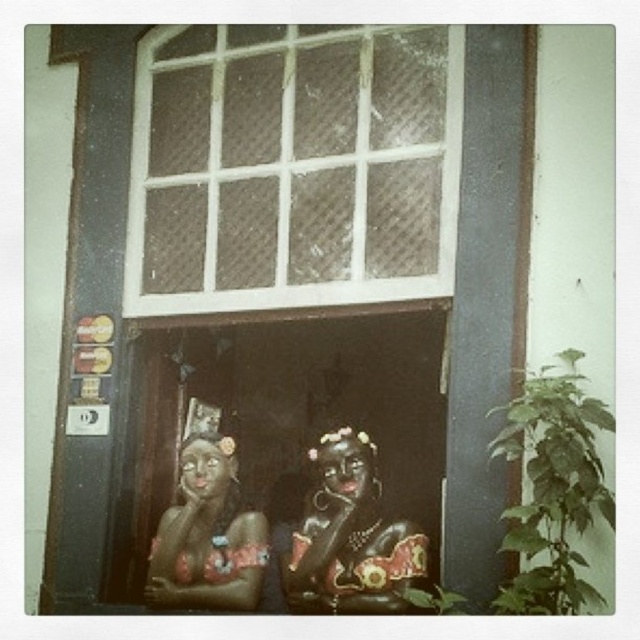
Question: Which point appears farthest from the camera in this image?

Choices:
 (A) (241, 554)
 (B) (419, 566)

Answer: (A)

Question: Can you confirm if white mesh screen at upper center is positioned to the left of matte ceramic statue at center?

Choices:
 (A) no
 (B) yes

Answer: (A)

Question: Among these points, which one is farthest from the camera?

Choices:
 (A) (204, 538)
 (B) (432, 106)
 (C) (356, 444)

Answer: (A)

Question: Is white mesh screen at upper center wider than black glossy statue at center?

Choices:
 (A) yes
 (B) no

Answer: (A)

Question: Is white mesh screen at upper center thinner than matte ceramic statue at center?

Choices:
 (A) no
 (B) yes

Answer: (A)

Question: Which object appears closest to the camera in this image?

Choices:
 (A) white mesh screen at upper center
 (B) matte ceramic statue at center

Answer: (A)